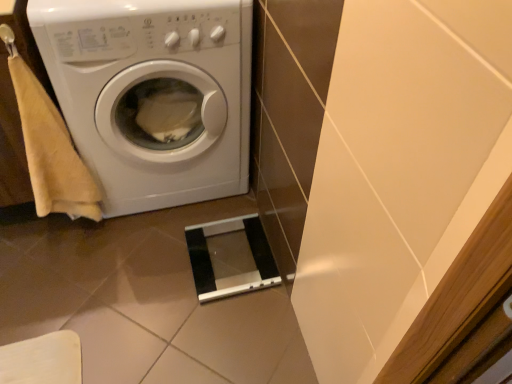
Question: Considering the relative sizes of beige cotton hand towel at left and white glossy washing machine at left in the image provided, is beige cotton hand towel at left shorter than white glossy washing machine at left?

Choices:
 (A) yes
 (B) no

Answer: (A)

Question: From a real-world perspective, is beige cotton hand towel at left below white glossy washing machine at left?

Choices:
 (A) no
 (B) yes

Answer: (A)

Question: Can you confirm if beige cotton hand towel at left is wider than white glossy washing machine at left?

Choices:
 (A) yes
 (B) no

Answer: (B)

Question: From the image's perspective, does beige cotton hand towel at left appear higher than white glossy washing machine at left?

Choices:
 (A) no
 (B) yes

Answer: (A)

Question: Is the depth of beige cotton hand towel at left greater than that of white glossy washing machine at left?

Choices:
 (A) no
 (B) yes

Answer: (A)

Question: Is beige cotton hand towel at left smaller than white glossy washing machine at left?

Choices:
 (A) yes
 (B) no

Answer: (A)

Question: Is white glossy washing machine at left facing away from beige cotton hand towel at left?

Choices:
 (A) no
 (B) yes

Answer: (A)

Question: Does white glossy washing machine at left appear on the right side of beige cotton hand towel at left?

Choices:
 (A) yes
 (B) no

Answer: (A)

Question: Does white glossy washing machine at left have a greater height compared to beige cotton hand towel at left?

Choices:
 (A) no
 (B) yes

Answer: (B)

Question: Is white glossy washing machine at left wider than beige cotton hand towel at left?

Choices:
 (A) no
 (B) yes

Answer: (B)

Question: Considering the relative sizes of white glossy washing machine at left and beige cotton hand towel at left in the image provided, is white glossy washing machine at left bigger than beige cotton hand towel at left?

Choices:
 (A) no
 (B) yes

Answer: (B)

Question: From the image's perspective, is white glossy washing machine at left located beneath beige cotton hand towel at left?

Choices:
 (A) no
 (B) yes

Answer: (A)

Question: Do you think beige cotton hand towel at left is within white glossy washing machine at left, or outside of it?

Choices:
 (A) outside
 (B) inside

Answer: (A)